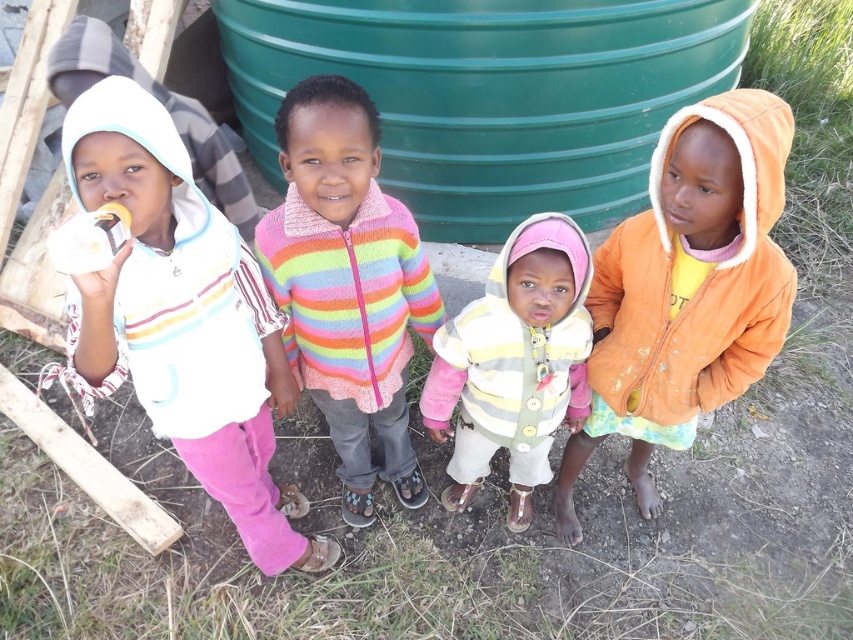
You are a photographer trying to capture a group photo of the white fleece hoodie at left and the striped knit sweater at center. Since you want to include both in the frame, which direction should you position yourself relative to the children?

You should position yourself to the right of the children because the white fleece hoodie at left is to the left of the striped knit sweater at center, so standing to the right would allow both to be in the frame.

What are the coordinates of the white fleece hoodie at left?

The white fleece hoodie at left is located at coordinates point (x=183, y=320).

What is located at the coordinates point [183,320]?

The white fleece hoodie at left is located at point [183,320].